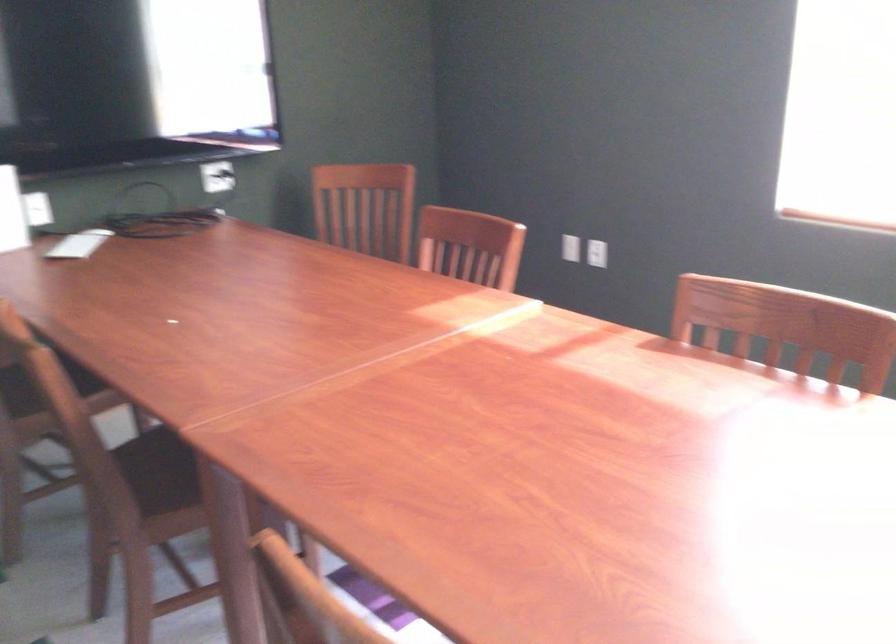
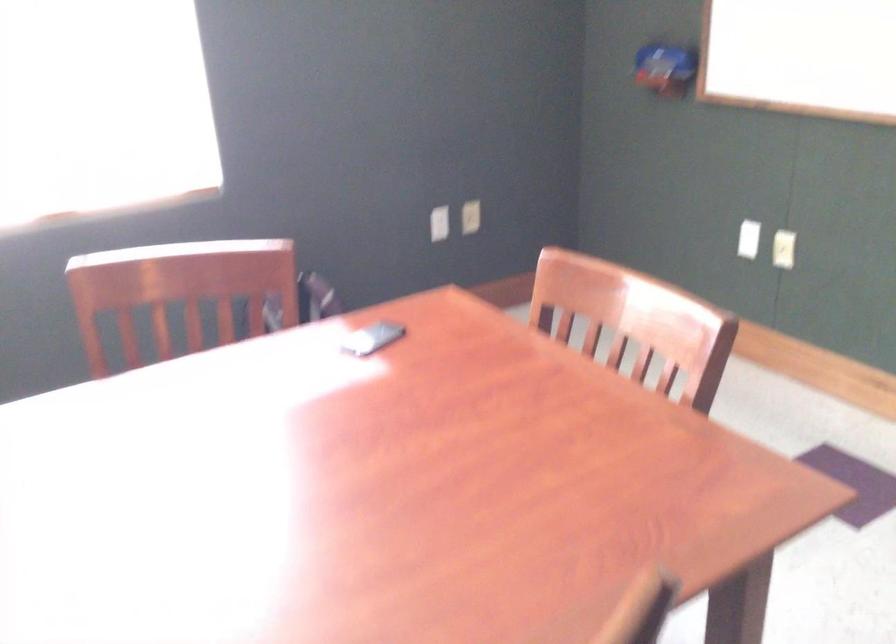
Based on the continuous images, in which direction is the camera rotating?

The camera's rotation is toward right-down.